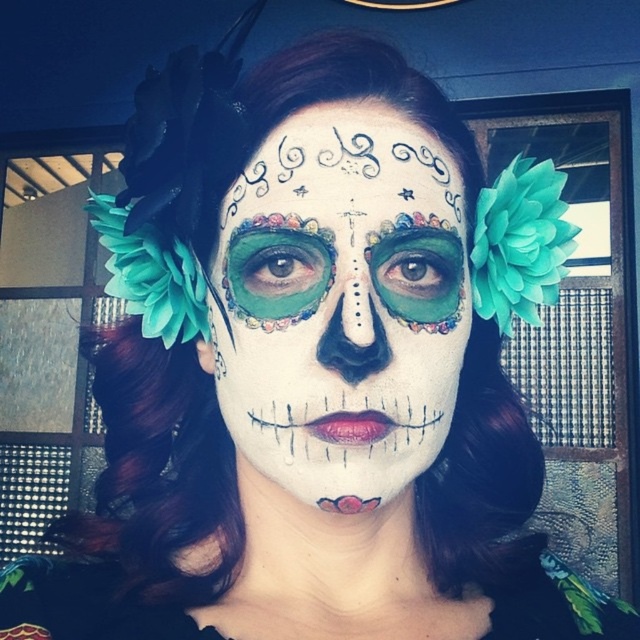
Question: Is white matte face paint at center wider than matte black dress at center?

Choices:
 (A) no
 (B) yes

Answer: (A)

Question: Is white matte face paint at center to the right of matte black dress at center from the viewer's perspective?

Choices:
 (A) no
 (B) yes

Answer: (B)

Question: Which point is closer to the camera taking this photo?

Choices:
 (A) (93, 636)
 (B) (260, 195)

Answer: (B)

Question: Can you confirm if white matte face paint at center is wider than matte black dress at center?

Choices:
 (A) yes
 (B) no

Answer: (B)